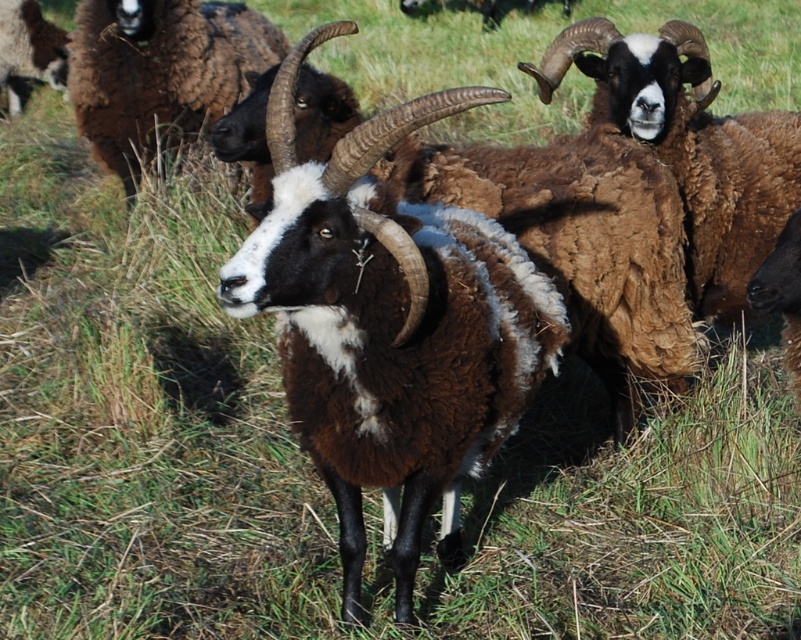
Question: Which of these objects is positioned closest to the brown woolly goat at center?

Choices:
 (A) brown woolly goat at upper left
 (B) brown woolly ram at upper right
 (C) brown woolen sheep at upper left

Answer: (B)

Question: Which of the following is the farthest from the observer?

Choices:
 (A) brown woolly goat at center
 (B) brown woolly goat at upper left
 (C) brown woolen sheep at upper left
 (D) brown woolly ram at upper right

Answer: (C)

Question: Considering the real-world distances, which object is farthest from the brown woolly ram at upper right?

Choices:
 (A) brown woolly goat at upper left
 (B) brown woolly goat at center

Answer: (A)

Question: Does brown woolly goat at center appear under brown woolen sheep at upper left?

Choices:
 (A) no
 (B) yes

Answer: (B)

Question: Where is brown woolly goat at center located in relation to brown woolen sheep at upper left in the image?

Choices:
 (A) left
 (B) right

Answer: (B)

Question: Does brown woolly goat at center have a larger size compared to brown woolly goat at upper left?

Choices:
 (A) no
 (B) yes

Answer: (A)